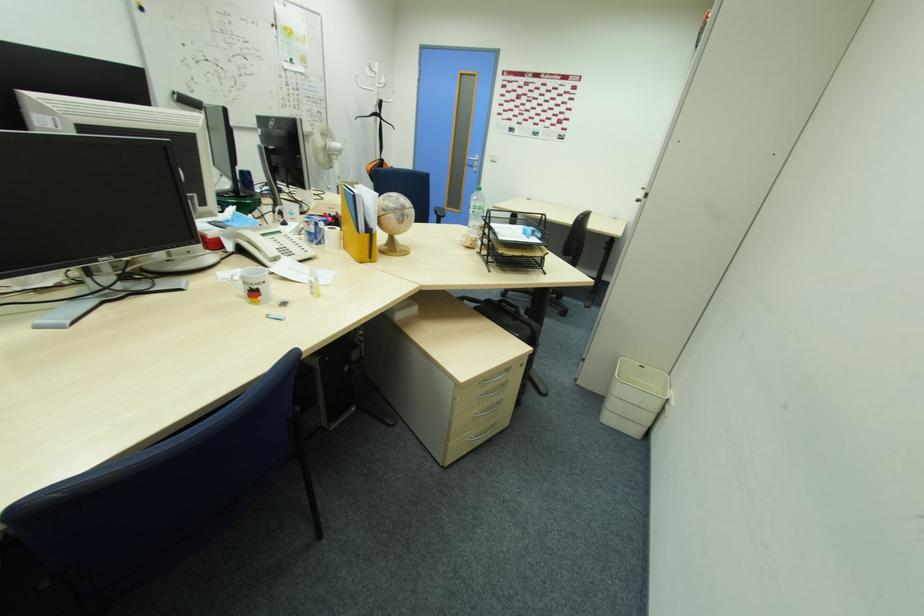
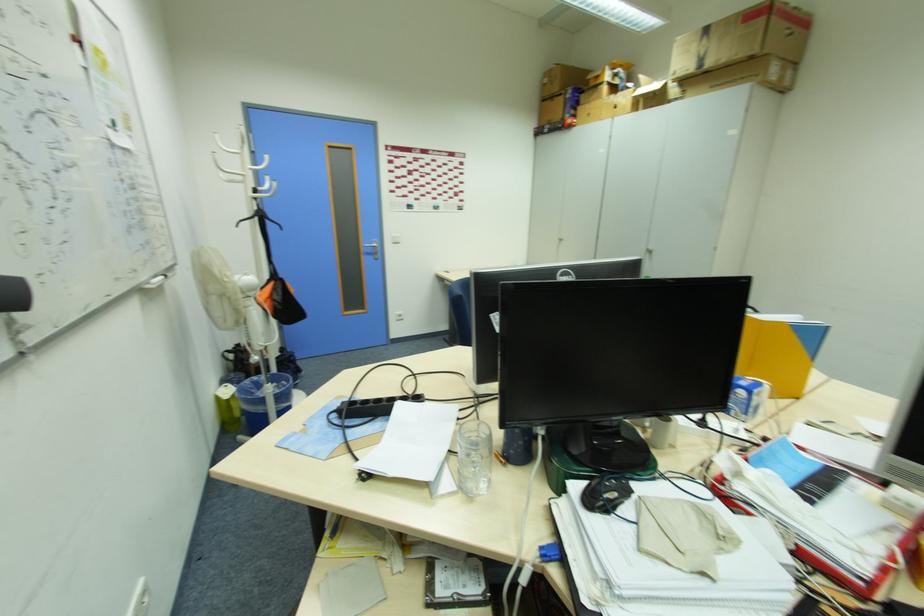
Locate, in the second image, the point that corresponds to [375,176] in the first image.

(283, 309)